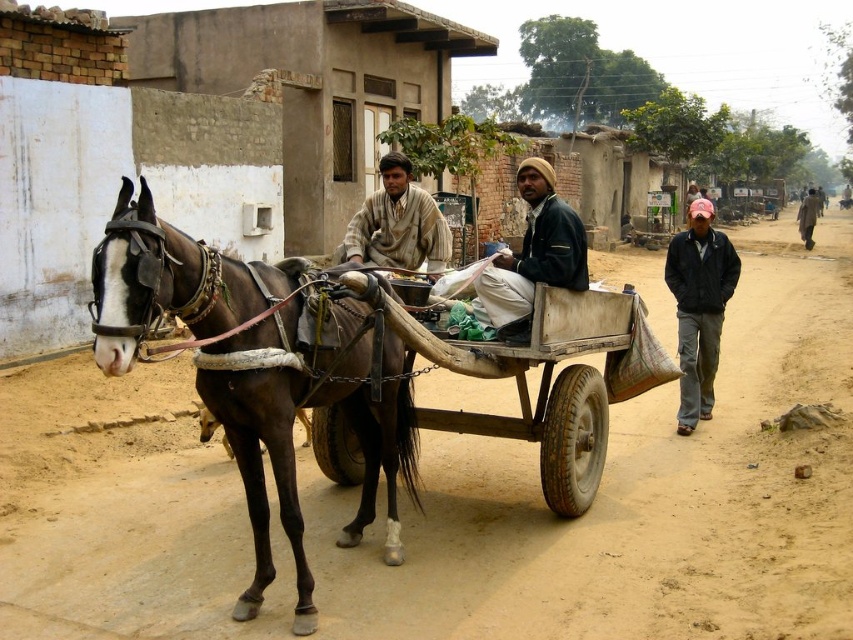
Question: Is brown dirt track at lower left to the left of wooden cart at center from the viewer's perspective?

Choices:
 (A) yes
 (B) no

Answer: (B)

Question: Which point appears farthest from the camera in this image?

Choices:
 (A) (698, 556)
 (B) (543, 419)
 (C) (386, 193)

Answer: (C)

Question: Is wooden cart at center further to camera compared to pink fabric cap at right?

Choices:
 (A) no
 (B) yes

Answer: (A)

Question: Which point is closer to the camera taking this photo?

Choices:
 (A) (363, 372)
 (B) (413, 300)
 (C) (482, 300)
 (D) (706, 234)

Answer: (A)

Question: Which point is closer to the camera?

Choices:
 (A) wooden cart at center
 (B) brown glossy horse at left
 (C) brown woolen sweater at center

Answer: (B)

Question: Is brown glossy horse at left behind wooden cart at center?

Choices:
 (A) no
 (B) yes

Answer: (A)